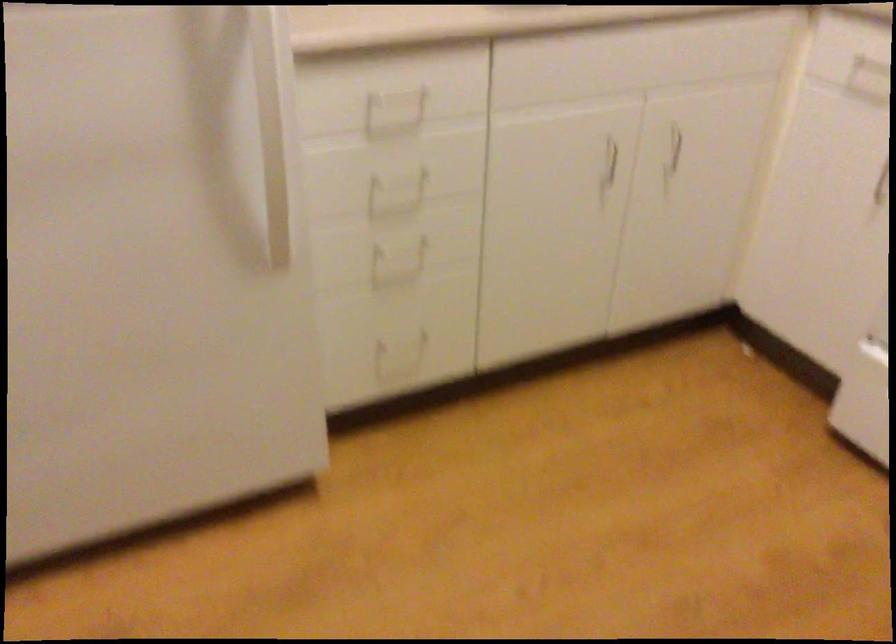
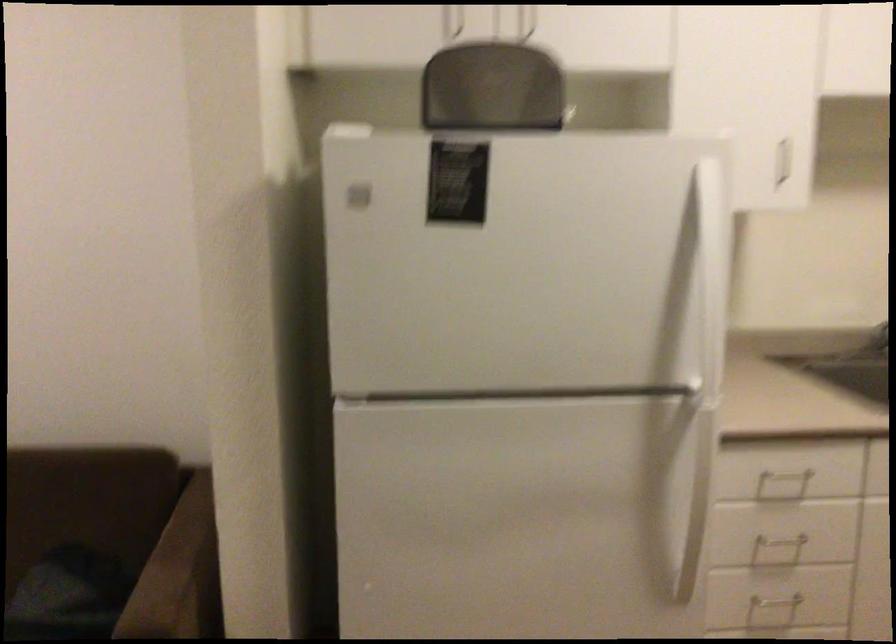
The point at (398,251) is marked in the first image. Where is the corresponding point in the second image?

(773, 608)